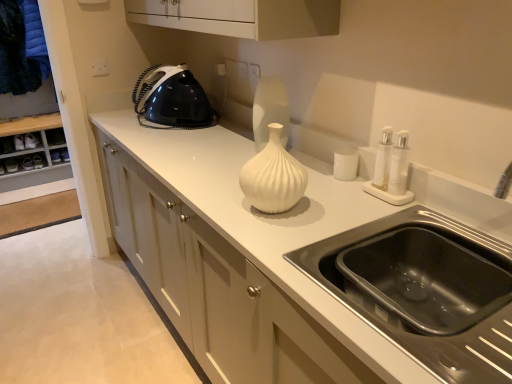
Identify the location of free space below white matte vase at center (from a real-world perspective). This screenshot has width=512, height=384. (267, 211).